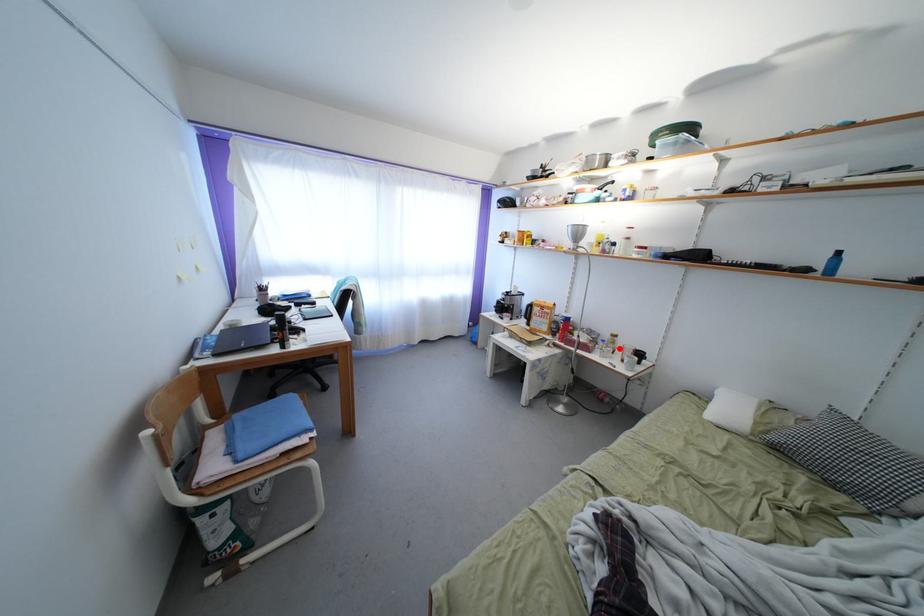
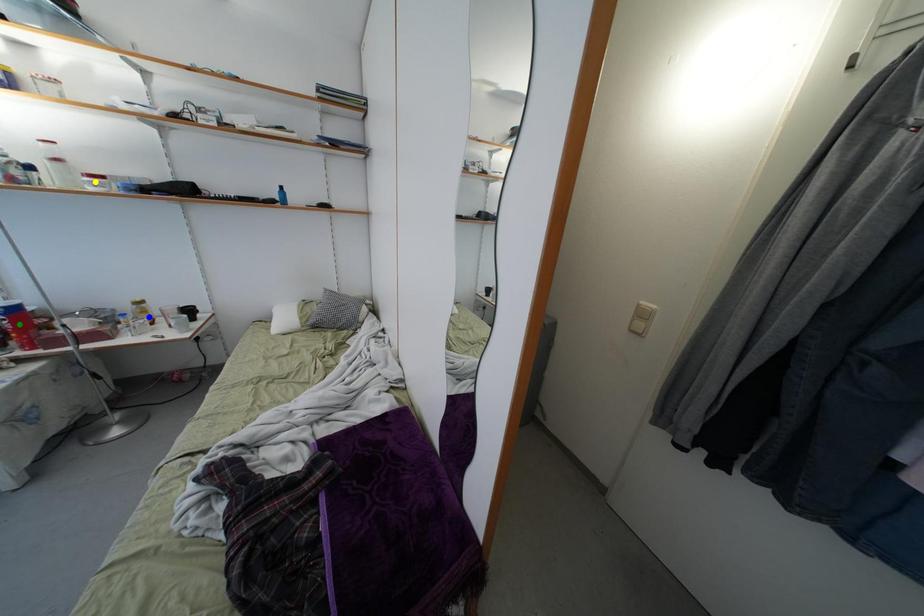
Question: I am providing you with two images of the same scene from different viewpoints. A red point is marked on the first image. You are given multiple points on the second image. Which point in image 2 is actually the same real-world point as the red point in image 1?

Choices:
 (A) yellow point
 (B) blue point
 (C) green point

Answer: (B)